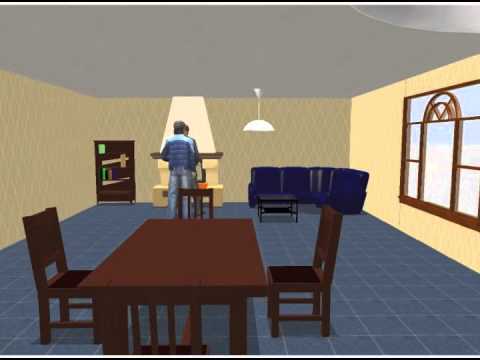
Find the location of a particular element. The width and height of the screenshot is (480, 360). lamp is located at coordinates (247, 109).